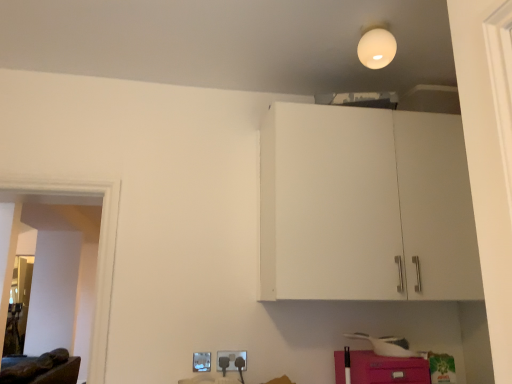
Question: Looking at the image, does pink matte cabinet at lower right seem bigger or smaller compared to brown leather couch at lower left?

Choices:
 (A) big
 (B) small

Answer: (B)

Question: Considering the positions of point (394, 357) and point (57, 367), is point (394, 357) closer or farther from the camera than point (57, 367)?

Choices:
 (A) farther
 (B) closer

Answer: (B)

Question: Estimate the real-world distances between objects in this image. Which object is farther from the pink matte cabinet at lower right?

Choices:
 (A) matte plastic electric outlet at lower center, which appears as the 1th electric outlet when viewed from the right
 (B) white matte light bulb at upper center
 (C) brown leather couch at lower left
 (D) white plastic electric outlet at lower center, the 2th electric outlet positioned from the right

Answer: (C)

Question: Which object is the closest to the matte plastic electric outlet at lower center, which is the second electric outlet from left to right?

Choices:
 (A) pink matte cabinet at lower right
 (B) brown leather couch at lower left
 (C) white plastic electric outlet at lower center, the 1th electric outlet from the left
 (D) white matte light bulb at upper center

Answer: (C)